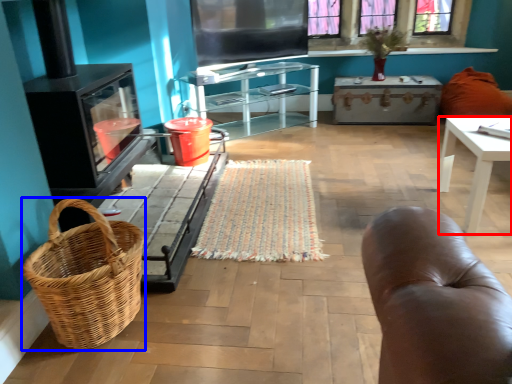
Question: Which point is further to the camera, desk (highlighted by a red box) or picnic basket (highlighted by a blue box)?

Choices:
 (A) desk
 (B) picnic basket

Answer: (A)